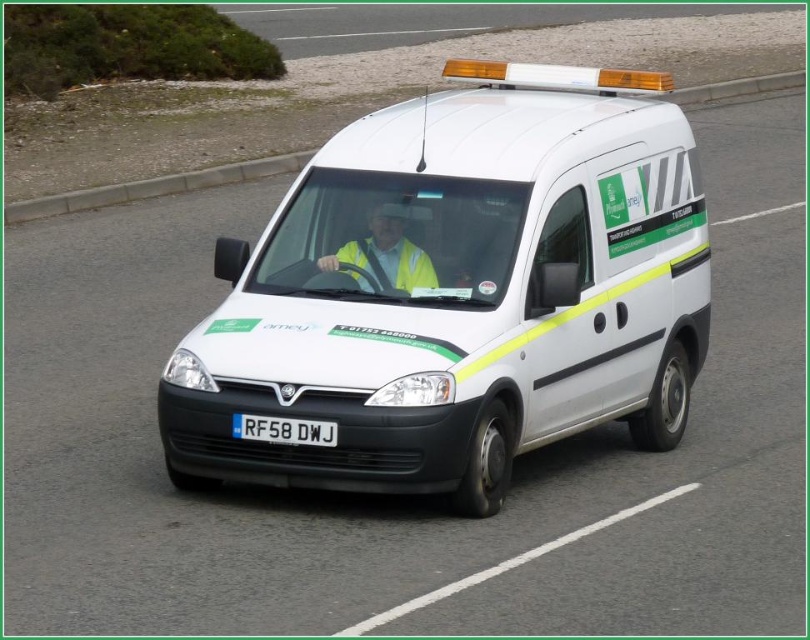
Can you confirm if yellow reflective vest at center is wider than white plastic license plate at center?

Indeed, yellow reflective vest at center has a greater width compared to white plastic license plate at center.

Is point (410, 244) positioned before point (243, 420)?

No, it is not.

What do you see at coordinates (382, 253) in the screenshot? I see `yellow reflective vest at center` at bounding box center [382, 253].

This screenshot has width=810, height=640. What are the coordinates of `yellow reflective vest at center` in the screenshot? It's located at (382, 253).

Does point (249, 365) lie behind point (377, 289)?

No, it is in front of (377, 289).

How much distance is there between white matte van at center and yellow reflective vest at center?

white matte van at center and yellow reflective vest at center are 25.64 inches apart from each other.

Does point (276, 260) lie behind point (369, 221)?

Yes, it is.

This screenshot has height=640, width=810. I want to click on white matte van at center, so click(x=461, y=292).

Is white matte van at center to the right of white plastic license plate at center from the viewer's perspective?

Yes, white matte van at center is to the right of white plastic license plate at center.

Who is lower down, white matte van at center or white plastic license plate at center?

white plastic license plate at center is below.

This screenshot has height=640, width=810. Find the location of `white matte van at center`. white matte van at center is located at coordinates (461, 292).